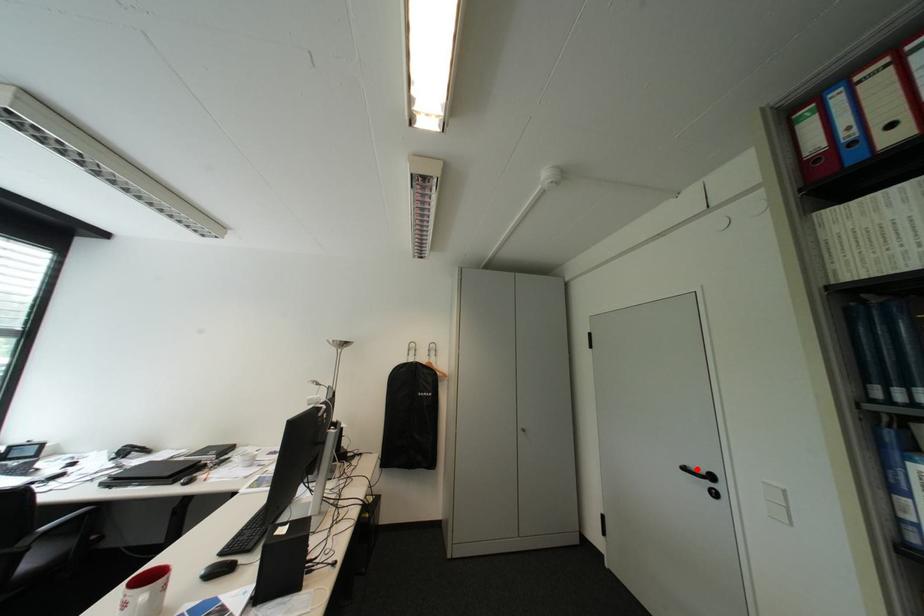
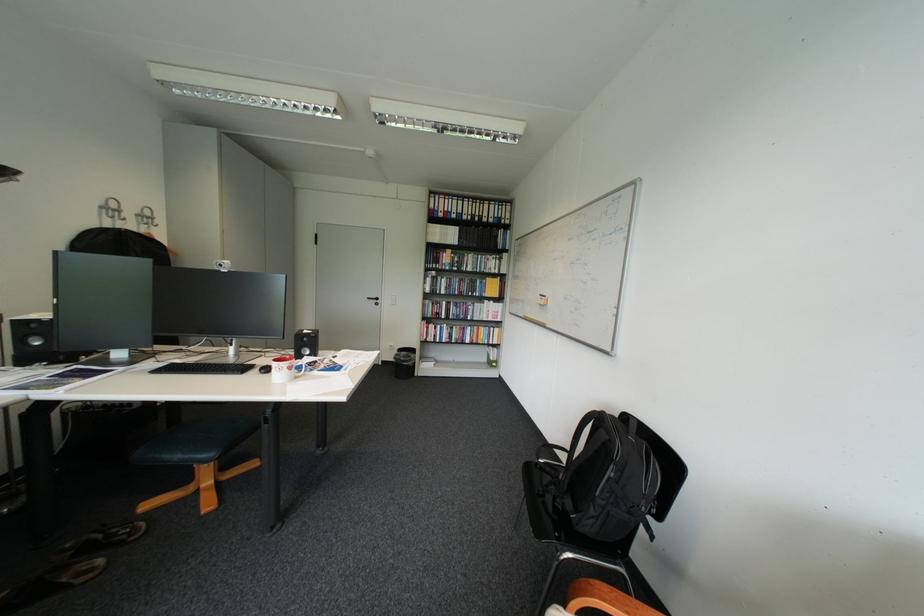
Locate, in the second image, the point that corresponds to the highlighted location in the first image.

(381, 299)